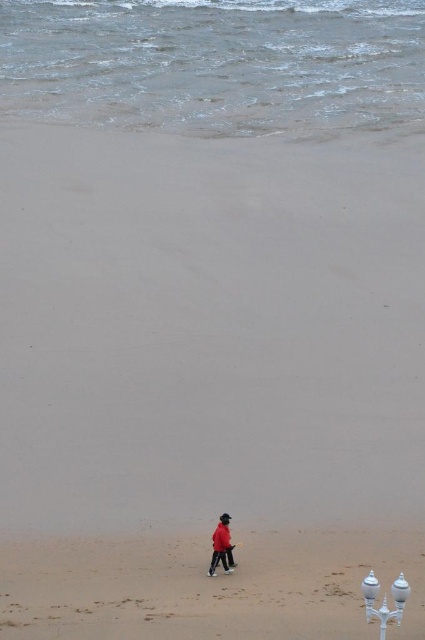
Which is in front, point (50, 618) or point (226, 563)?

Positioned in front is point (50, 618).

Find the location of a particular element. The image size is (425, 640). sandy beach at lower center is located at coordinates (206, 588).

I want to click on sandy beach at lower center, so click(x=206, y=588).